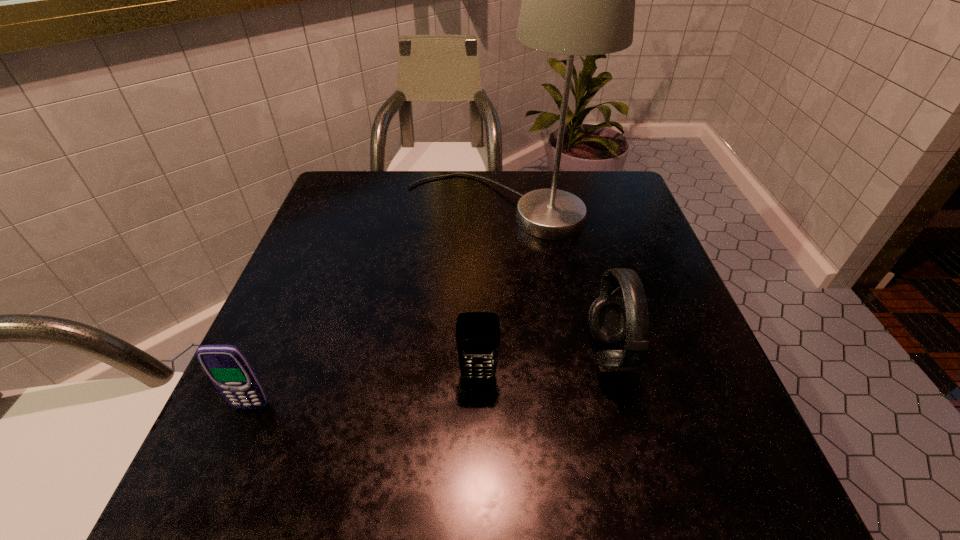
In the image, there is a desktop. At what (x,y) coordinates should I click in order to perform the action: click on vacant area at the far right corner. Please return your answer as a coordinate pair (x, y). This screenshot has width=960, height=540. Looking at the image, I should click on (x=574, y=173).

Locate an element on the screen. The height and width of the screenshot is (540, 960). empty space between the nearer cellular telephone and the headset is located at coordinates (430, 380).

You are a GUI agent. You are given a task and a screenshot of the screen. Output one action in this format:
    pyautogui.click(x=<x>, y=<y>)
    Task: Click on the vacant area that lies between the nearest object and the farther cellular telephone
    This screenshot has height=540, width=960.
    Given the screenshot: What is the action you would take?
    pyautogui.click(x=365, y=392)

Image resolution: width=960 pixels, height=540 pixels. In order to click on free spot between the table lamp and the headset in this screenshot , I will do pyautogui.click(x=553, y=281).

Identify the location of vacant area between the farther cellular telephone and the headset. The image size is (960, 540). 544,366.

Identify the location of free spot between the leftmost object and the table lamp. (374, 307).

Locate an element on the screen. The image size is (960, 540). empty space that is in between the leftmost object and the right cellular telephone is located at coordinates (365, 392).

Locate an element on the screen. This screenshot has width=960, height=540. vacant space in between the right cellular telephone and the nearer cellular telephone is located at coordinates (365, 392).

The height and width of the screenshot is (540, 960). I want to click on free area in between the headset and the leftmost object, so click(x=430, y=380).

Identify the location of empty space between the table lamp and the leftmost object. (374, 307).